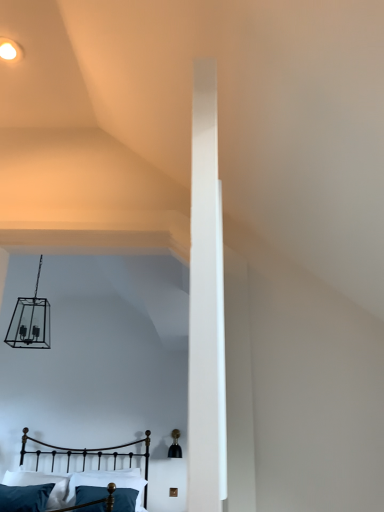
I want to click on matte white ceiling light at upper left, so click(10, 51).

What do you see at coordinates (84, 455) in the screenshot?
I see `metallic black bed at lower left` at bounding box center [84, 455].

How much space does velvety teal pillow at lower left, which is the second pillow in right-to-left order, occupy horizontally?

It is 12.46 inches.

Where is `teal fabric pillow at lower center, acting as the 1th pillow starting from the right`? The height and width of the screenshot is (512, 384). teal fabric pillow at lower center, acting as the 1th pillow starting from the right is located at coordinates (125, 499).

Identify the location of matte white ceiling light at upper left. (x=10, y=51).

Consider the image. Could teal fabric pillow at lower center, which appears as the second pillow when viewed from the left, be considered to be inside matte white ceiling light at upper left?

No, teal fabric pillow at lower center, which appears as the second pillow when viewed from the left, is not surrounded by matte white ceiling light at upper left.

Is matte white ceiling light at upper left to the right of teal fabric pillow at lower center, which appears as the second pillow when viewed from the left, from the viewer's perspective?

Correct, you'll find matte white ceiling light at upper left to the right of teal fabric pillow at lower center, which appears as the second pillow when viewed from the left.

Is point (0, 38) positioned before point (98, 508)?

Yes, it is.

Looking at this image, would you say matte white ceiling light at upper left is a long distance from teal fabric pillow at lower center, which appears as the second pillow when viewed from the left?

matte white ceiling light at upper left is positioned a significant distance from teal fabric pillow at lower center, which appears as the second pillow when viewed from the left.

Based on the photo, is matte white ceiling light at upper left far away from metallic black bed at lower left?

Absolutely, matte white ceiling light at upper left is distant from metallic black bed at lower left.

From the image's perspective, is matte white ceiling light at upper left below metallic black bed at lower left?

Incorrect, from the image's perspective, matte white ceiling light at upper left is higher than metallic black bed at lower left.

Which object is thinner, matte white ceiling light at upper left or metallic black bed at lower left?

With smaller width is matte white ceiling light at upper left.

Can you confirm if velvety teal pillow at lower left, which is the second pillow in right-to-left order, is thinner than teal fabric pillow at lower center, which appears as the second pillow when viewed from the left?

No, velvety teal pillow at lower left, which is the second pillow in right-to-left order, is not thinner than teal fabric pillow at lower center, which appears as the second pillow when viewed from the left.

Is velvety teal pillow at lower left, which is counted as the first pillow, starting from the left, oriented away from teal fabric pillow at lower center, acting as the 1th pillow starting from the right?

velvety teal pillow at lower left, which is counted as the first pillow, starting from the left, is not turned away from teal fabric pillow at lower center, acting as the 1th pillow starting from the right.

How different are the orientations of velvety teal pillow at lower left, which is counted as the first pillow, starting from the left, and teal fabric pillow at lower center, acting as the 1th pillow starting from the right, in degrees?

The angular difference between velvety teal pillow at lower left, which is counted as the first pillow, starting from the left, and teal fabric pillow at lower center, acting as the 1th pillow starting from the right, is 0.00275 degrees.

Between point (118, 488) and point (61, 496), which one is positioned behind?

The point (118, 488) is more distant.

How far apart are teal fabric pillow at lower center, acting as the 1th pillow starting from the right, and velvety teal pillow at lower left, which is counted as the first pillow, starting from the left?

teal fabric pillow at lower center, acting as the 1th pillow starting from the right, and velvety teal pillow at lower left, which is counted as the first pillow, starting from the left, are 30.10 inches apart.

Which object is positioned more to the right, teal fabric pillow at lower center, acting as the 1th pillow starting from the right, or velvety teal pillow at lower left, which is counted as the first pillow, starting from the left?

teal fabric pillow at lower center, acting as the 1th pillow starting from the right, is more to the right.

Who is more distant, teal fabric pillow at lower center, which appears as the second pillow when viewed from the left, or velvety teal pillow at lower left, which is counted as the first pillow, starting from the left?

teal fabric pillow at lower center, which appears as the second pillow when viewed from the left, is further from the camera.

How many degrees apart are the facing directions of metallic black bed at lower left and matte white ceiling light at upper left?

metallic black bed at lower left and matte white ceiling light at upper left are facing 0.89 degrees away from each other.

Between metallic black bed at lower left and matte white ceiling light at upper left, which one has smaller size?

matte white ceiling light at upper left is smaller.

From a real-world perspective, is metallic black bed at lower left located beneath matte white ceiling light at upper left?

Yes, from a real-world perspective, metallic black bed at lower left is beneath matte white ceiling light at upper left.

Is metallic black bed at lower left turned away from matte white ceiling light at upper left?

No, metallic black bed at lower left is not facing the opposite direction of matte white ceiling light at upper left.

From the image's perspective, is teal fabric pillow at lower center, which appears as the second pillow when viewed from the left, below metallic black bed at lower left?

Yes, from the image's perspective, teal fabric pillow at lower center, which appears as the second pillow when viewed from the left, is below metallic black bed at lower left.

Is teal fabric pillow at lower center, acting as the 1th pillow starting from the right, directly adjacent to metallic black bed at lower left?

No, teal fabric pillow at lower center, acting as the 1th pillow starting from the right, is not making contact with metallic black bed at lower left.

How far apart are teal fabric pillow at lower center, acting as the 1th pillow starting from the right, and metallic black bed at lower left?

teal fabric pillow at lower center, acting as the 1th pillow starting from the right, and metallic black bed at lower left are 3.30 feet apart from each other.

Would you say teal fabric pillow at lower center, acting as the 1th pillow starting from the right, contains metallic black bed at lower left?

No, metallic black bed at lower left is located outside of teal fabric pillow at lower center, acting as the 1th pillow starting from the right.

What's the angular difference between velvety teal pillow at lower left, which is counted as the first pillow, starting from the left, and metallic black bed at lower left's facing directions?

The angular difference between velvety teal pillow at lower left, which is counted as the first pillow, starting from the left, and metallic black bed at lower left is 4.31 degrees.

From the image's perspective, does velvety teal pillow at lower left, which is the second pillow in right-to-left order, appear lower than metallic black bed at lower left?

Yes, from the image's perspective, velvety teal pillow at lower left, which is the second pillow in right-to-left order, is beneath metallic black bed at lower left.

Does velvety teal pillow at lower left, which is the second pillow in right-to-left order, lie behind metallic black bed at lower left?

That is True.

Is velvety teal pillow at lower left, which is counted as the first pillow, starting from the left, at the left side of metallic black bed at lower left?

Yes, velvety teal pillow at lower left, which is counted as the first pillow, starting from the left, is to the left of metallic black bed at lower left.

Identify the location of pillow that is the 1st object to the left of the matte white ceiling light at upper left, starting at the anchor. This screenshot has width=384, height=512. (125, 499).

The height and width of the screenshot is (512, 384). Identify the location of light fixture that is on the right side of metallic black bed at lower left. (10, 51).

When comparing their distances from metallic black bed at lower left, does teal fabric pillow at lower center, which appears as the second pillow when viewed from the left, or matte white ceiling light at upper left seem further?

matte white ceiling light at upper left.

From the image, which object appears to be farther from velvety teal pillow at lower left, which is counted as the first pillow, starting from the left, teal fabric pillow at lower center, acting as the 1th pillow starting from the right, or matte white ceiling light at upper left?

The object further to velvety teal pillow at lower left, which is counted as the first pillow, starting from the left, is matte white ceiling light at upper left.

Looking at this image, from the image, which object appears to be nearer to velvety teal pillow at lower left, which is the second pillow in right-to-left order, matte white ceiling light at upper left or teal fabric pillow at lower center, which appears as the second pillow when viewed from the left?

The object closer to velvety teal pillow at lower left, which is the second pillow in right-to-left order, is teal fabric pillow at lower center, which appears as the second pillow when viewed from the left.

When comparing their distances from velvety teal pillow at lower left, which is counted as the first pillow, starting from the left, does metallic black bed at lower left or matte white ceiling light at upper left seem closer?

metallic black bed at lower left.

Looking at the image, which one is located closer to metallic black bed at lower left, matte white ceiling light at upper left or velvety teal pillow at lower left, which is counted as the first pillow, starting from the left?

velvety teal pillow at lower left, which is counted as the first pillow, starting from the left, is closer to metallic black bed at lower left.

Looking at the image, which one is located closer to teal fabric pillow at lower center, acting as the 1th pillow starting from the right, metallic black bed at lower left or velvety teal pillow at lower left, which is counted as the first pillow, starting from the left?

The object closer to teal fabric pillow at lower center, acting as the 1th pillow starting from the right, is velvety teal pillow at lower left, which is counted as the first pillow, starting from the left.

Considering their positions, is teal fabric pillow at lower center, which appears as the second pillow when viewed from the left, positioned closer to velvety teal pillow at lower left, which is the second pillow in right-to-left order, than metallic black bed at lower left?

metallic black bed at lower left.

From the image, which object appears to be nearer to matte white ceiling light at upper left, metallic black bed at lower left or velvety teal pillow at lower left, which is the second pillow in right-to-left order?

Based on the image, velvety teal pillow at lower left, which is the second pillow in right-to-left order, appears to be nearer to matte white ceiling light at upper left.

In order to click on bed between matte white ceiling light at upper left and teal fabric pillow at lower center, which appears as the second pillow when viewed from the left, from top to bottom in this screenshot , I will do `click(84, 455)`.

Identify the location of pillow between metallic black bed at lower left and teal fabric pillow at lower center, acting as the 1th pillow starting from the right, from front to back. The width and height of the screenshot is (384, 512). (40, 483).

This screenshot has width=384, height=512. I want to click on bed that lies between matte white ceiling light at upper left and velvety teal pillow at lower left, which is the second pillow in right-to-left order, from top to bottom, so click(84, 455).

Find the location of a particular element. This screenshot has width=384, height=512. pillow between matte white ceiling light at upper left and teal fabric pillow at lower center, which appears as the second pillow when viewed from the left, from top to bottom is located at coordinates (40, 483).